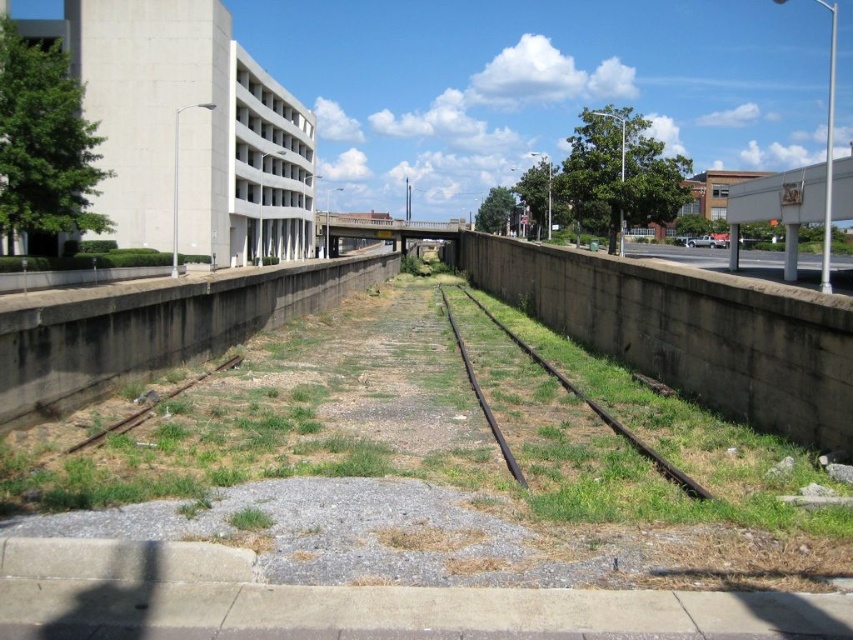
Can you confirm if green grass at center is positioned below rusty metal train track at center?

No, green grass at center is not below rusty metal train track at center.

Who is lower down, green grass at center or rusty metal train track at center?

Positioned lower is rusty metal train track at center.

Does point (553, 516) come closer to viewer compared to point (477, 305)?

Yes, it is in front of point (477, 305).

Locate an element on the screen. The image size is (853, 640). green grass at center is located at coordinates (434, 452).